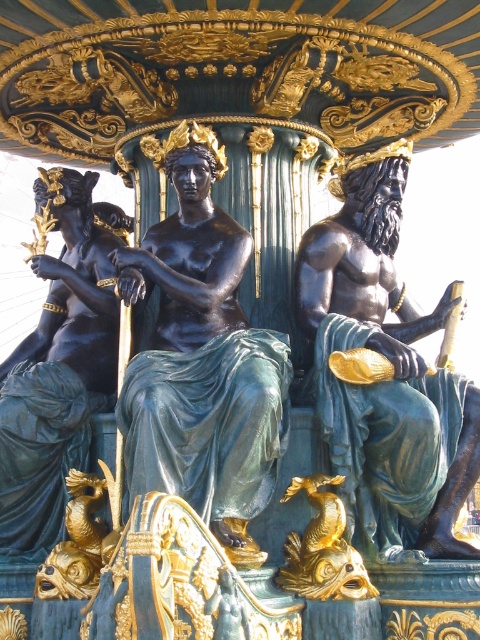
Question: Among these objects, which one is nearest to the camera?

Choices:
 (A) black polished stone man at center
 (B) bronze statue at center
 (C) bronze statue at left

Answer: (B)

Question: Can you confirm if bronze statue at center is bigger than black polished stone man at center?

Choices:
 (A) yes
 (B) no

Answer: (B)

Question: Among these objects, which one is nearest to the camera?

Choices:
 (A) bronze statue at left
 (B) black polished stone man at center

Answer: (B)

Question: Can you confirm if bronze statue at center is smaller than bronze statue at left?

Choices:
 (A) no
 (B) yes

Answer: (B)

Question: Is bronze statue at center above black polished stone man at center?

Choices:
 (A) yes
 (B) no

Answer: (A)

Question: Which object is the farthest from the black polished stone man at center?

Choices:
 (A) bronze statue at center
 (B) bronze statue at left

Answer: (B)